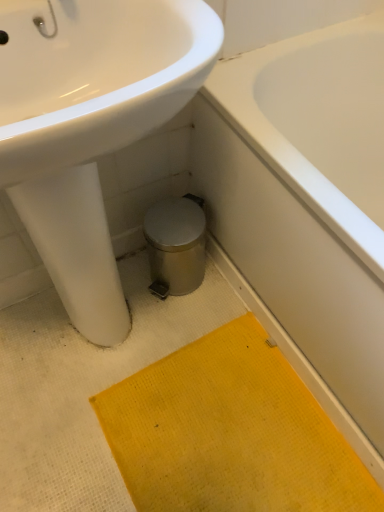
Locate an element on the screen. This screenshot has width=384, height=512. vacant point above yellow textured bath mat at lower center (from a real-world perspective) is located at coordinates (211, 441).